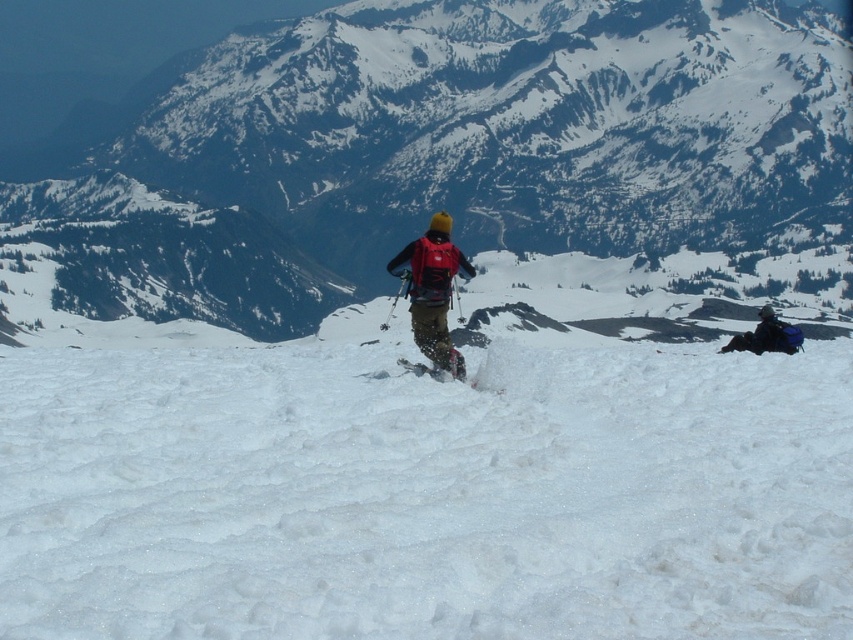
Question: Is white snow at center to the right of matte black ski at center from the viewer's perspective?

Choices:
 (A) no
 (B) yes

Answer: (A)

Question: In this image, where is matte red backpack at center located relative to matte black ski at center?

Choices:
 (A) below
 (B) above

Answer: (B)

Question: Which point is closer to the camera taking this photo?

Choices:
 (A) (734, 74)
 (B) (384, 625)
 (C) (412, 260)
 (D) (422, 364)

Answer: (B)

Question: Estimate the real-world distances between objects in this image. Which object is farther from the white snow mountain at center?

Choices:
 (A) blue fabric backpack at right
 (B) matte red backpack at center

Answer: (B)

Question: Does matte red backpack at center come in front of matte black ski at center?

Choices:
 (A) no
 (B) yes

Answer: (A)

Question: Among these objects, which one is nearest to the camera?

Choices:
 (A) white snow at center
 (B) blue fabric backpack at right

Answer: (A)